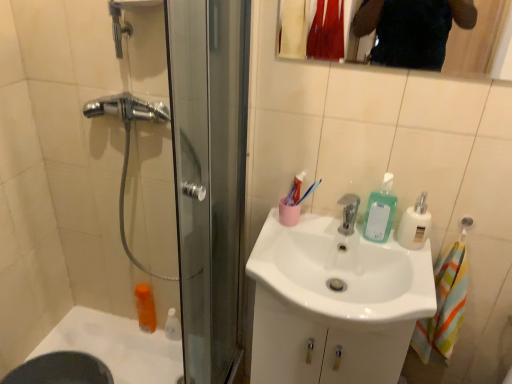
Locate an element on the screen. The image size is (512, 384). white glossy sink at center is located at coordinates (343, 272).

The image size is (512, 384). Describe the element at coordinates (145, 308) in the screenshot. I see `orange plastic mouthwash at lower left` at that location.

What is the approximate width of orange plastic mouthwash at lower left?

orange plastic mouthwash at lower left is 3.84 inches wide.

Measure the distance between white glossy bottle at lower left and camera.

They are 1.76 meters apart.

Where is `white glossy bottle at lower left`? This screenshot has height=384, width=512. white glossy bottle at lower left is located at coordinates (173, 326).

The height and width of the screenshot is (384, 512). Describe the element at coordinates (380, 212) in the screenshot. I see `translucent plastic soap dispenser at sink right, the 1th soap dispenser viewed from the left` at that location.

The width and height of the screenshot is (512, 384). What do you see at coordinates (415, 225) in the screenshot? I see `white plastic soap dispenser at upper right, which ranks as the 2th soap dispenser in left-to-right order` at bounding box center [415, 225].

Find the location of a particular element. The image size is (512, 384). white glossy bath at lower left is located at coordinates (117, 346).

Is point (425, 202) positioned after point (463, 46)?

No, it is in front of (463, 46).

From a real-world perspective, who is located lower, white plastic soap dispenser at upper right, placed as the first soap dispenser when sorted from right to left, or clear glass mirror at upper center?

From a 3D spatial view, white plastic soap dispenser at upper right, placed as the first soap dispenser when sorted from right to left, is below.

Who is taller, white plastic soap dispenser at upper right, which ranks as the 2th soap dispenser in left-to-right order, or clear glass mirror at upper center?

With more height is clear glass mirror at upper center.

Locate an element on the screen. This screenshot has height=384, width=512. soap dispenser that is the 1st object located behind the clear glass mirror at upper center is located at coordinates (415, 225).

Is white glossy bottle at lower left not near translucent plastic soap dispenser at sink right, the 1th soap dispenser viewed from the left?

No, white glossy bottle at lower left is not far away from translucent plastic soap dispenser at sink right, the 1th soap dispenser viewed from the left.

From the picture: Is translucent plastic soap dispenser at sink right, arranged as the 2th soap dispenser when viewed from the right, surrounded by white glossy bottle at lower left?

No, translucent plastic soap dispenser at sink right, arranged as the 2th soap dispenser when viewed from the right, is located outside of white glossy bottle at lower left.

Considering the relative positions of white glossy bottle at lower left and translucent plastic soap dispenser at sink right, the 1th soap dispenser viewed from the left, in the image provided, is white glossy bottle at lower left to the left of translucent plastic soap dispenser at sink right, the 1th soap dispenser viewed from the left, from the viewer's perspective?

Yes.

Which of these two, white glossy sink at center or white glossy bath at lower left, is thinner?

white glossy sink at center is thinner.

Is white glossy sink at center outside of white glossy bath at lower left?

white glossy sink at center lies outside white glossy bath at lower left's area.

From their relative heights in the image, would you say white glossy sink at center is taller or shorter than white glossy bath at lower left?

In the image, white glossy sink at center appears to be taller than white glossy bath at lower left.

How far apart are white plastic soap dispenser at upper right, placed as the first soap dispenser when sorted from right to left, and translucent plastic soap dispenser at sink right, arranged as the 2th soap dispenser when viewed from the right?

white plastic soap dispenser at upper right, placed as the first soap dispenser when sorted from right to left, is 3.07 inches from translucent plastic soap dispenser at sink right, arranged as the 2th soap dispenser when viewed from the right.

Which object is wider, white plastic soap dispenser at upper right, placed as the first soap dispenser when sorted from right to left, or translucent plastic soap dispenser at sink right, the 1th soap dispenser viewed from the left?

With larger width is white plastic soap dispenser at upper right, placed as the first soap dispenser when sorted from right to left.

From the picture: Is the surface of white plastic soap dispenser at upper right, placed as the first soap dispenser when sorted from right to left, in direct contact with translucent plastic soap dispenser at sink right, arranged as the 2th soap dispenser when viewed from the right?

Yes, white plastic soap dispenser at upper right, placed as the first soap dispenser when sorted from right to left, is right next to translucent plastic soap dispenser at sink right, arranged as the 2th soap dispenser when viewed from the right, and making contact.

Is white plastic soap dispenser at upper right, which ranks as the 2th soap dispenser in left-to-right order, looking in the opposite direction of translucent plastic soap dispenser at sink right, the 1th soap dispenser viewed from the left?

No, white plastic soap dispenser at upper right, which ranks as the 2th soap dispenser in left-to-right order,'s orientation is not away from translucent plastic soap dispenser at sink right, the 1th soap dispenser viewed from the left.

Is white glossy sink at center bigger than clear glass mirror at upper center?

Indeed, white glossy sink at center has a larger size compared to clear glass mirror at upper center.

Image resolution: width=512 pixels, height=384 pixels. Find the location of `sink located on the left of clear glass mirror at upper center`. sink located on the left of clear glass mirror at upper center is located at coordinates (343, 272).

Would you say white glossy sink at center is a long distance from clear glass mirror at upper center?

white glossy sink at center is positioned a significant distance from clear glass mirror at upper center.

Which object is further away from the camera taking this photo, white glossy sink at center or clear glass mirror at upper center?

white glossy sink at center is behind.

Considering the relative positions of orange plastic mouthwash at lower left and white glossy bottle at lower left in the image provided, is orange plastic mouthwash at lower left to the right of white glossy bottle at lower left from the viewer's perspective?

In fact, orange plastic mouthwash at lower left is to the left of white glossy bottle at lower left.

Where is `mouthwash above the white glossy bottle at lower left (from a real-world perspective)`? mouthwash above the white glossy bottle at lower left (from a real-world perspective) is located at coordinates (145, 308).

Considering the points (151, 305) and (176, 317), which point is in front, point (151, 305) or point (176, 317)?

The point (176, 317) is more forward.

Who is shorter, orange plastic mouthwash at lower left or white glossy bottle at lower left?

With less height is white glossy bottle at lower left.

Is clear glass mirror at upper center oriented towards white glossy bath at lower left?

No, clear glass mirror at upper center is not turned towards white glossy bath at lower left.

Between point (288, 29) and point (133, 325), which one is positioned in front?

The point (288, 29) is in front.

Consider the image. Is white glossy bath at lower left completely or partially inside clear glass mirror at upper center?

No, white glossy bath at lower left is not a part of clear glass mirror at upper center.

Locate an element on the screen. This screenshot has height=384, width=512. mirror above the white plastic soap dispenser at upper right, which ranks as the 2th soap dispenser in left-to-right order (from a real-world perspective) is located at coordinates (478, 41).

Find the location of `toiletry that appears below the translucent plastic soap dispenser at sink right, arranged as the 2th soap dispenser when viewed from the right (from the image's perspective)`. toiletry that appears below the translucent plastic soap dispenser at sink right, arranged as the 2th soap dispenser when viewed from the right (from the image's perspective) is located at coordinates (173, 326).

From the image, which object appears to be nearer to white glossy bottle at lower left, white glossy bath at lower left or translucent plastic soap dispenser at sink right, the 1th soap dispenser viewed from the left?

white glossy bath at lower left is positioned closer to the anchor white glossy bottle at lower left.

Which object lies nearer to the anchor point white glossy bottle at lower left, translucent plastic soap dispenser at sink right, the 1th soap dispenser viewed from the left, or white glossy bath at lower left?

Among the two, white glossy bath at lower left is located nearer to white glossy bottle at lower left.

In the scene shown: Considering their positions, is orange plastic mouthwash at lower left positioned further to white glossy bath at lower left than white glossy sink at center?

white glossy sink at center.

From the image, which object appears to be nearer to orange plastic mouthwash at lower left, white plastic soap dispenser at upper right, placed as the first soap dispenser when sorted from right to left, or white glossy bottle at lower left?

white glossy bottle at lower left.

Looking at the image, which one is located further to translucent plastic soap dispenser at sink right, the 1th soap dispenser viewed from the left, orange plastic mouthwash at lower left or white glossy sink at center?

orange plastic mouthwash at lower left is further to translucent plastic soap dispenser at sink right, the 1th soap dispenser viewed from the left.

From the image, which object appears to be nearer to clear glass mirror at upper center, white glossy bottle at lower left or white glossy bath at lower left?

Based on the image, white glossy bath at lower left appears to be nearer to clear glass mirror at upper center.

Based on their spatial positions, is white glossy bottle at lower left or white glossy bath at lower left closer to orange plastic mouthwash at lower left?

The object closer to orange plastic mouthwash at lower left is white glossy bottle at lower left.

Which object lies further to the anchor point clear glass mirror at upper center, translucent plastic soap dispenser at sink right, arranged as the 2th soap dispenser when viewed from the right, or white glossy sink at center?

Based on the image, white glossy sink at center appears to be further to clear glass mirror at upper center.

At what (x,y) coordinates should I click in order to perform the action: click on sink between orange plastic mouthwash at lower left and white plastic soap dispenser at upper right, placed as the first soap dispenser when sorted from right to left. Please return your answer as a coordinate pair (x, y). The image size is (512, 384). Looking at the image, I should click on (343, 272).

Locate an element on the screen. Image resolution: width=512 pixels, height=384 pixels. mouthwash situated between white glossy bath at lower left and translucent plastic soap dispenser at sink right, arranged as the 2th soap dispenser when viewed from the right, from left to right is located at coordinates (145, 308).

Where is `toiletry between white glossy bath at lower left and translucent plastic soap dispenser at sink right, arranged as the 2th soap dispenser when viewed from the right`? toiletry between white glossy bath at lower left and translucent plastic soap dispenser at sink right, arranged as the 2th soap dispenser when viewed from the right is located at coordinates (173, 326).

Locate an element on the screen. This screenshot has width=512, height=384. toiletry between orange plastic mouthwash at lower left and translucent plastic soap dispenser at sink right, the 1th soap dispenser viewed from the left is located at coordinates (173, 326).